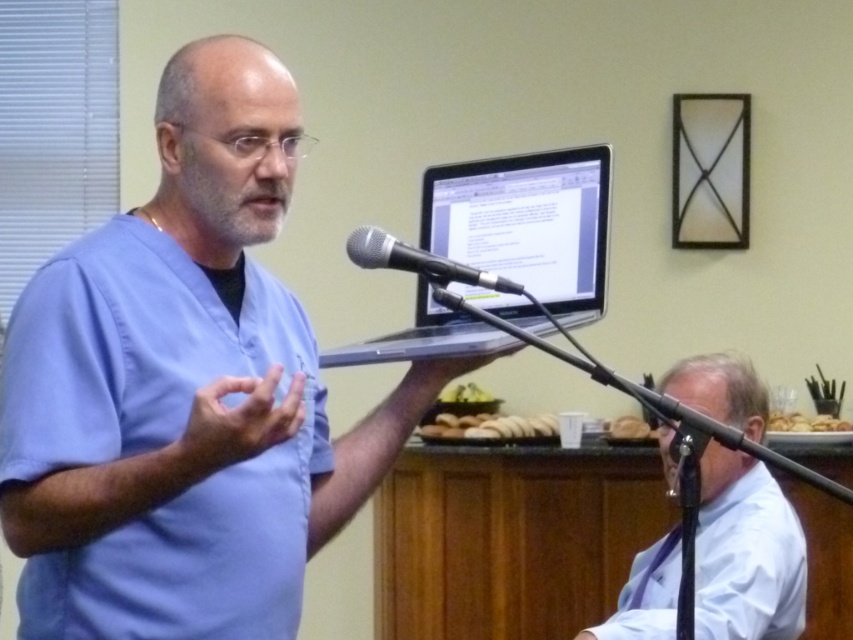
Does blue scrubs at center appear over yellow matte apples at center?

Yes, blue scrubs at center is above yellow matte apples at center.

Which is behind, point (64, 627) or point (460, 384)?

The point (460, 384) is more distant.

The width and height of the screenshot is (853, 640). What are the coordinates of `blue scrubs at center` in the screenshot? It's located at (184, 390).

Can you confirm if blue scrubs at center is positioned above golden brown crumbly bread at right?

Correct, blue scrubs at center is located above golden brown crumbly bread at right.

Does blue scrubs at center have a lesser width compared to golden brown crumbly bread at right?

In fact, blue scrubs at center might be wider than golden brown crumbly bread at right.

Measure the distance between blue scrubs at center and camera.

blue scrubs at center is 1.33 meters away from camera.

The image size is (853, 640). Identify the location of blue scrubs at center. (184, 390).

Who is higher up, black metallic microphone at center or golden brown crumbly bread at right?

Positioned higher is black metallic microphone at center.

Can you confirm if black metallic microphone at center is wider than golden brown crumbly bread at right?

No, black metallic microphone at center is not wider than golden brown crumbly bread at right.

Does point (477, 284) come in front of point (846, 428)?

That is True.

Find the location of `black metallic microphone at center`. black metallic microphone at center is located at coordinates (419, 260).